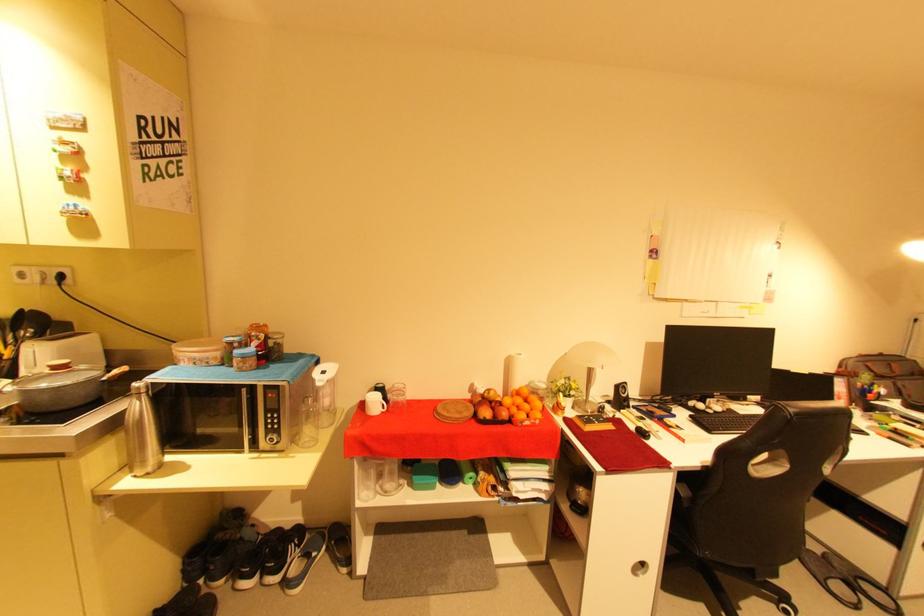
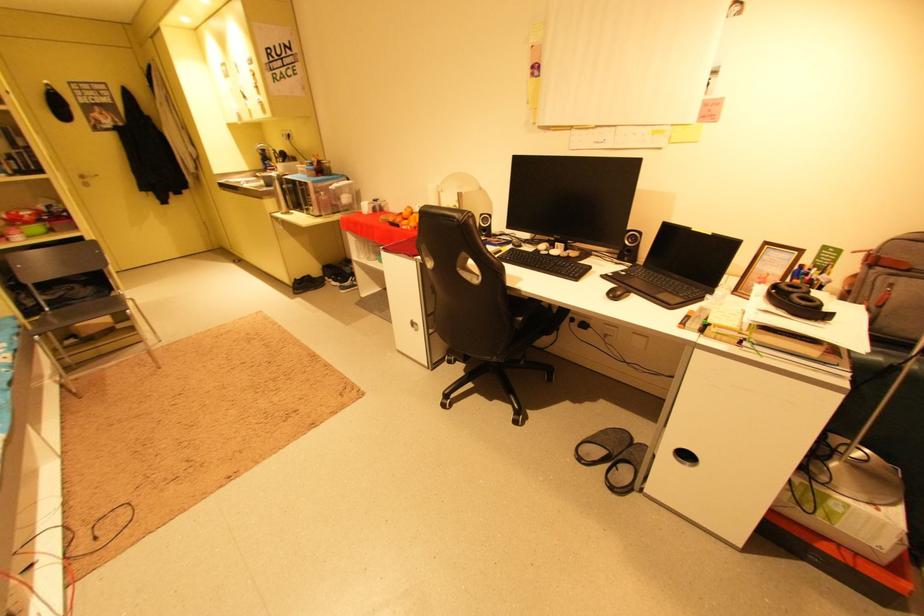
Where in the second image is the point corresponding to point 535,424 from the first image?

(410, 228)